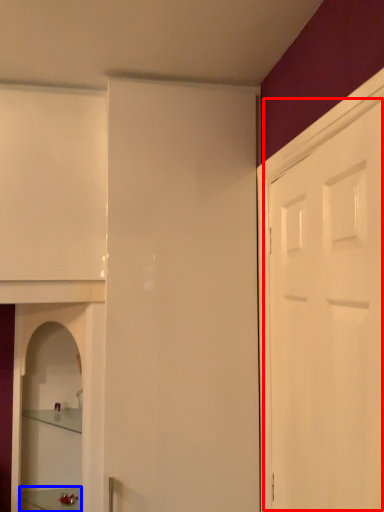
Question: Which of the following is the farthest to the observer, door (highlighted by a red box) or furniture (highlighted by a blue box)?

Choices:
 (A) door
 (B) furniture

Answer: (B)